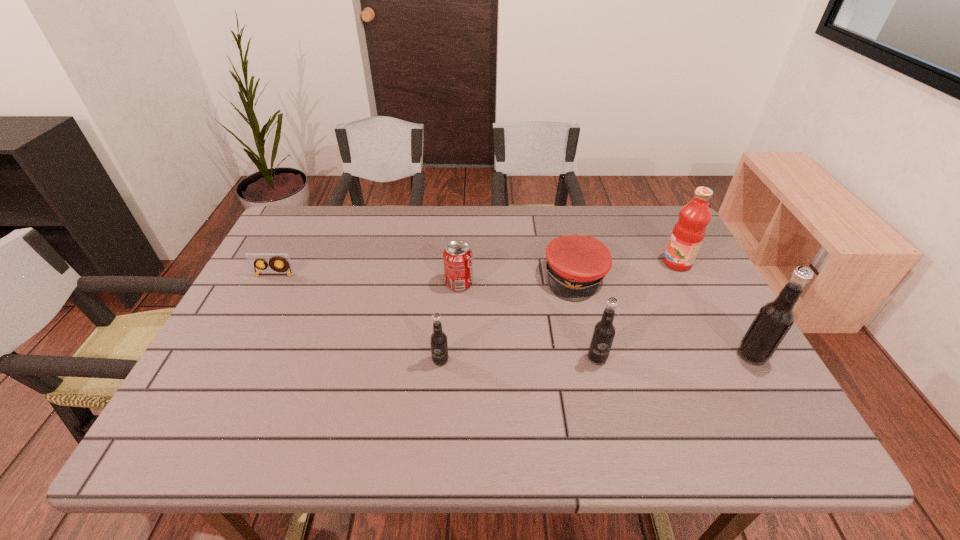
This screenshot has width=960, height=540. I want to click on free space between the third tallest object and the second shortest object, so click(x=587, y=318).

In order to click on free space between the soda can and the third tallest object in this screenshot , I will do `click(528, 321)`.

In order to click on vacant area that lies between the sixth tallest object and the soda can in this screenshot , I will do `click(517, 280)`.

Find the location of a particular element. free space between the leftmost root beer and the shortest object is located at coordinates (357, 318).

You are a GUI agent. You are given a task and a screenshot of the screen. Output one action in this format:
    pyautogui.click(x=<x>, y=<y>)
    Task: Click on the free space between the tallest root beer and the fifth shortest object
    
    Given the screenshot: What is the action you would take?
    pyautogui.click(x=675, y=356)

Identify which object is the fifth nearest to the fifth shortest object. Please provide its 2D coordinates. Your answer should be formatted as a tuple, i.e. [(x, y)], where the tuple contains the x and y coordinates of a point satisfying the conditions above.

[(689, 231)]

At what (x,y) coordinates should I click in order to perform the action: click on the third closest object relative to the second root beer from left to right. Please return your answer as a coordinate pair (x, y). Looking at the image, I should click on (438, 340).

Select which root beer appears as the closest to the tallest root beer. Please provide its 2D coordinates. Your answer should be formatted as a tuple, i.e. [(x, y)], where the tuple contains the x and y coordinates of a point satisfying the conditions above.

[(604, 330)]

Find the location of a particular element. The height and width of the screenshot is (540, 960). the third closest root beer relative to the fifth tallest object is located at coordinates (775, 318).

You are a GUI agent. You are given a task and a screenshot of the screen. Output one action in this format:
    pyautogui.click(x=<x>, y=<y>)
    Task: Click on the free space that satisfies the following two spatial constraints: 1. on the label of the rightmost root beer; 2. on the label of the shortest root beer
    
    Given the screenshot: What is the action you would take?
    pyautogui.click(x=755, y=360)